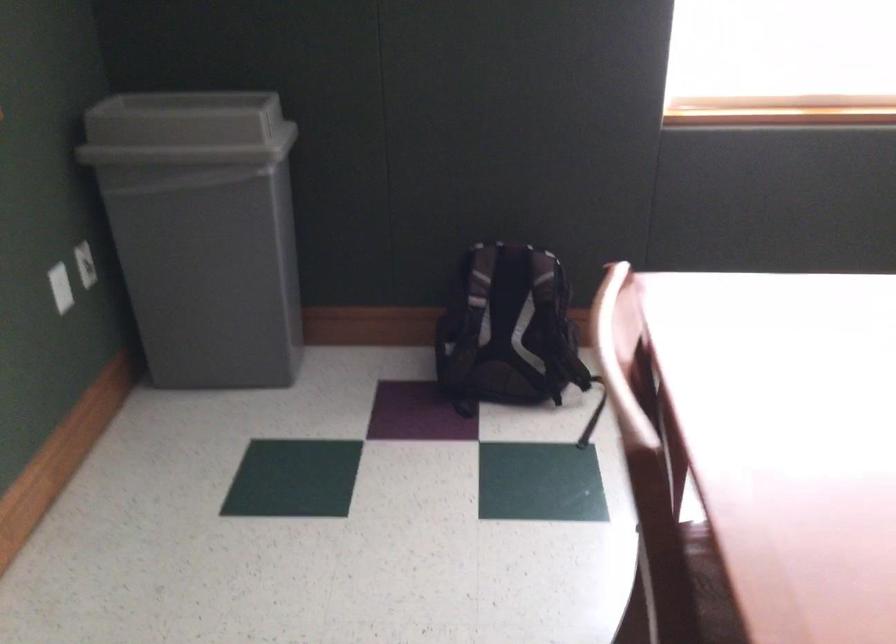
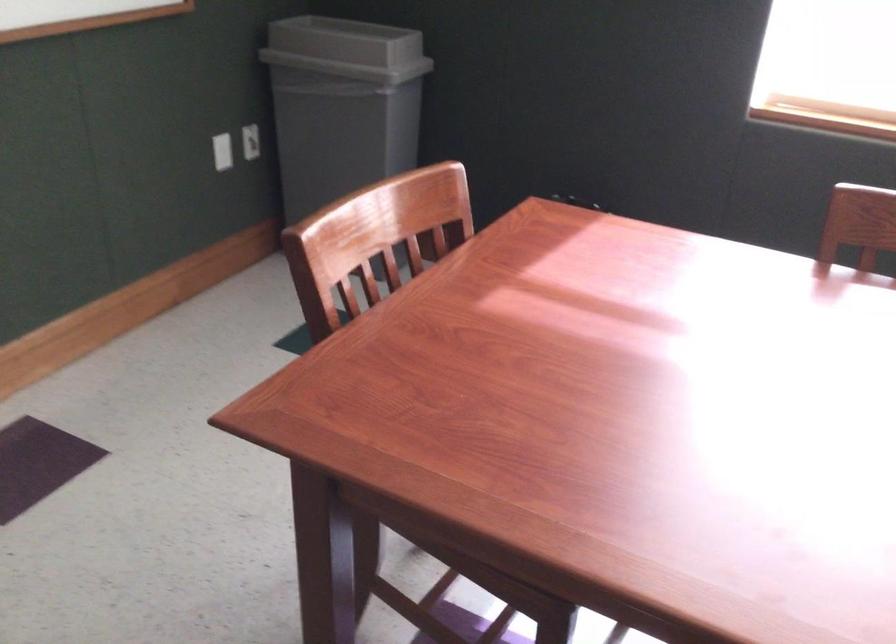
Question: Based on the continuous images, in which direction is the camera rotating? Reply with the corresponding letter.

Choices:
 (A) Left
 (B) Right
 (C) Up
 (D) Down

Answer: (A)